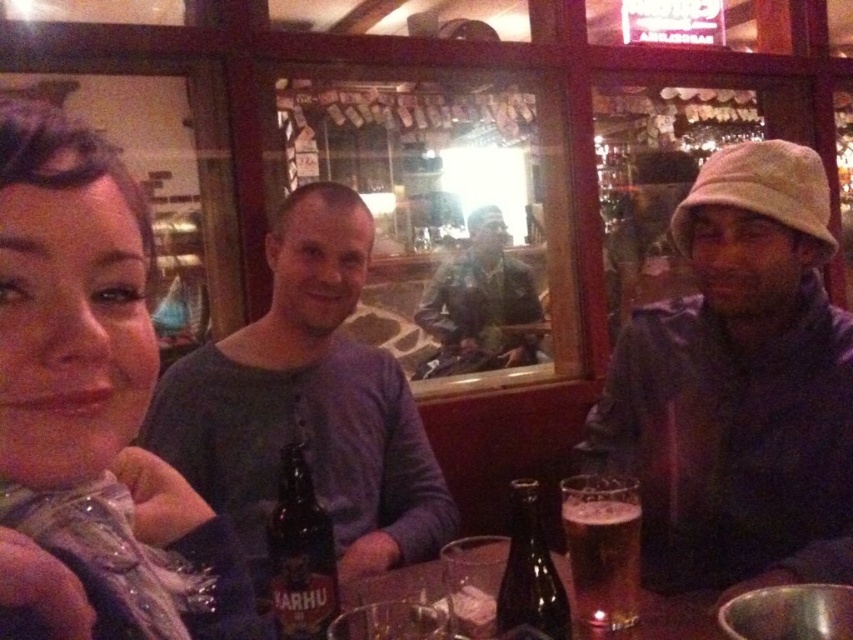
You are a bartender who needs to place a new drink order between the matte gray hat at right and the purple soft sweater at center. The drink tray is 50 centimeters wide. Will the tray fit between them?

The distance between the matte gray hat at right and the purple soft sweater at center is 51.71 centimeters, so the 50 centimeter tray will fit since it is narrower than the space available.

You are a barista who needs to place a new menu stand on the table. The menu stand is 15 cm tall. Considering the objects on the table, will the matte black scarf at left and the dark brown glass bottle at center block the view of the menu stand?

The matte black scarf at left is taller than the dark brown glass bottle at center. Since the menu stand is only 15 cm tall, the taller matte black scarf at left may block its view, but the shorter dark brown glass bottle at center might not. However, both objects could potentially block the menu stand depending on their exact positions. To ensure visibility, place the menu stand where it is not behind either object.